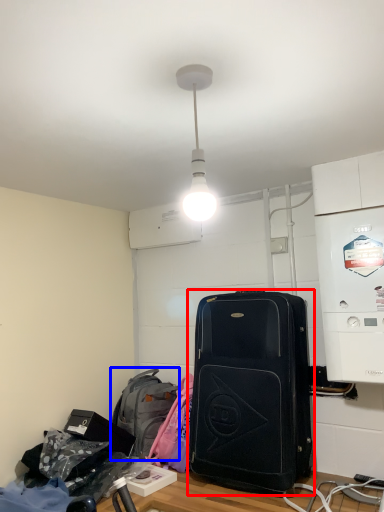
Question: Which of the following is the closest to the observer, luggage and bags (highlighted by a red box) or backpack (highlighted by a blue box)?

Choices:
 (A) luggage and bags
 (B) backpack

Answer: (A)